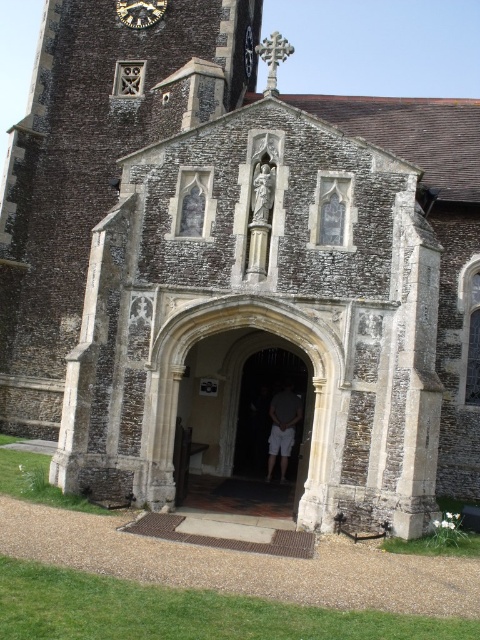
Question: Which point appears farthest from the camera in this image?

Choices:
 (A) (288, 412)
 (B) (134, 20)

Answer: (B)

Question: From the image, what is the correct spatial relationship of light gray cotton shorts at center in relation to metallic clock face at upper center?

Choices:
 (A) below
 (B) above

Answer: (A)

Question: Does light gray cotton shorts at center come behind metallic clock face at upper center?

Choices:
 (A) no
 (B) yes

Answer: (A)

Question: Is light gray cotton shorts at center bigger than metallic clock face at upper center?

Choices:
 (A) yes
 (B) no

Answer: (B)

Question: Among these objects, which one is nearest to the camera?

Choices:
 (A) light gray cotton shorts at center
 (B) metallic clock face at upper center

Answer: (A)